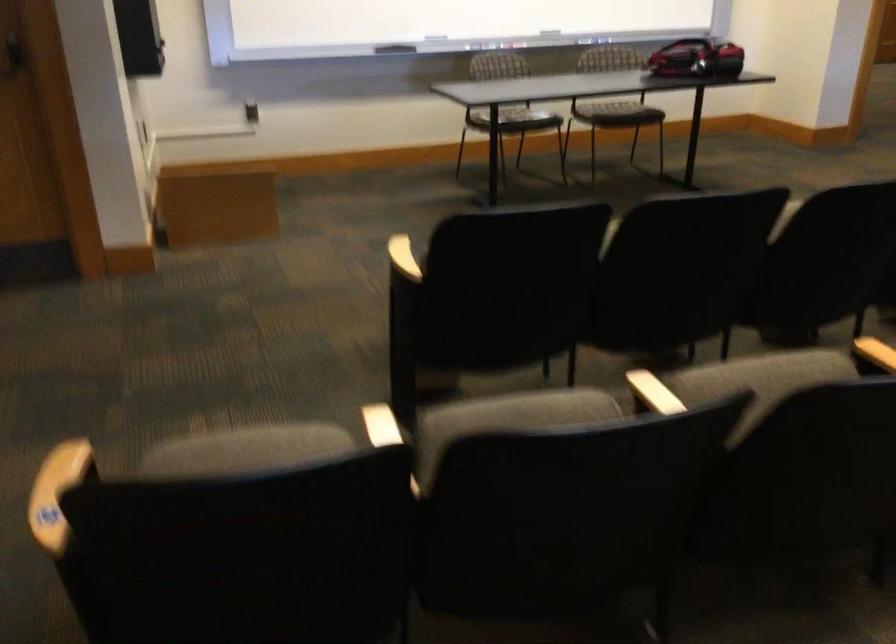
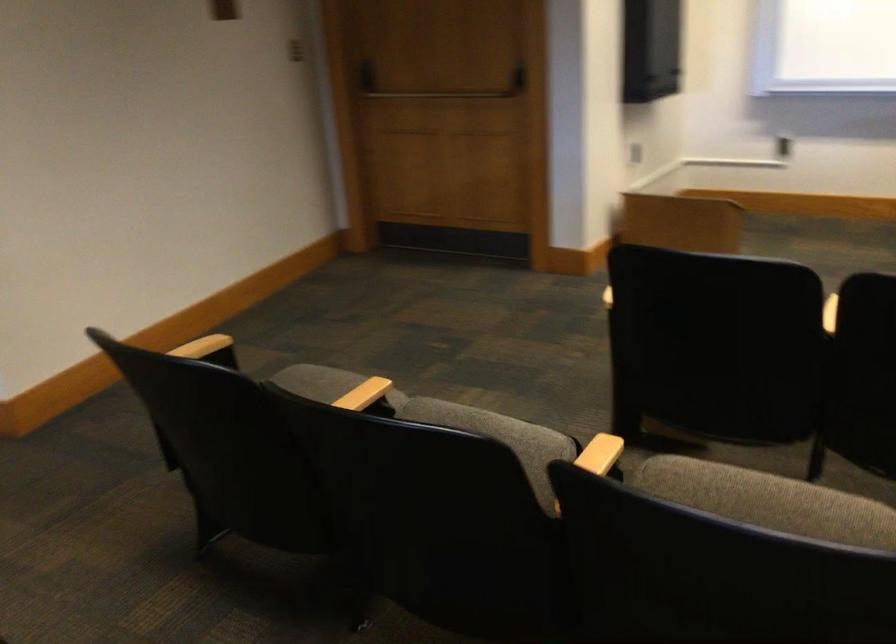
Locate, in the second image, the point that corresponds to [643,384] in the first image.

(600, 455)